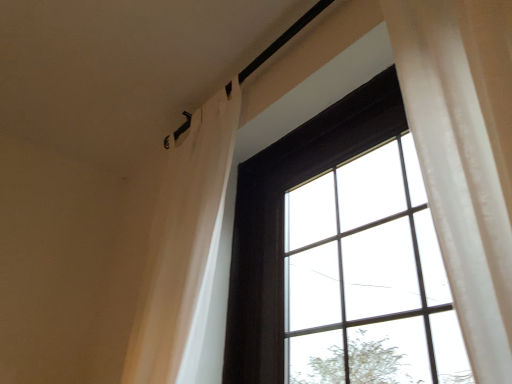
Describe the element at coordinates (340, 256) in the screenshot. I see `matte black window at center` at that location.

Find the location of a particular element. This screenshot has width=512, height=384. matte black window at center is located at coordinates (340, 256).

The width and height of the screenshot is (512, 384). In order to click on white sheer curtain at upper left in this screenshot , I will do `click(184, 245)`.

Image resolution: width=512 pixels, height=384 pixels. Describe the element at coordinates (184, 245) in the screenshot. I see `white sheer curtain at upper left` at that location.

Identify the location of matte black window at center. (340, 256).

From the picture: Considering the relative positions of white sheer curtain at upper left and matte black window at center in the image provided, is white sheer curtain at upper left to the left of matte black window at center from the viewer's perspective?

Yes.

Does white sheer curtain at upper left lie in front of matte black window at center?

No.

Which is nearer, (x=189, y=226) or (x=394, y=159)?

Point (x=189, y=226) is positioned farther from the camera compared to point (x=394, y=159).

From the image's perspective, which is above, white sheer curtain at upper left or matte black window at center?

white sheer curtain at upper left appears higher in the image.

Based on the photo, from a real-world perspective, is white sheer curtain at upper left on matte black window at center?

Indeed, from a real-world perspective, white sheer curtain at upper left stands above matte black window at center.

Is white sheer curtain at upper left thinner than matte black window at center?

In fact, white sheer curtain at upper left might be wider than matte black window at center.

Who is shorter, white sheer curtain at upper left or matte black window at center?

matte black window at center.

Based on their sizes in the image, would you say white sheer curtain at upper left is bigger or smaller than matte black window at center?

white sheer curtain at upper left is smaller than matte black window at center.

Is white sheer curtain at upper left not within matte black window at center?

Indeed, white sheer curtain at upper left is completely outside matte black window at center.

Can you see white sheer curtain at upper left touching matte black window at center?

No, white sheer curtain at upper left is not touching matte black window at center.

Could you tell me if white sheer curtain at upper left is facing matte black window at center?

No, white sheer curtain at upper left is not facing towards matte black window at center.

Identify the location of window that appears on the right of white sheer curtain at upper left. (340, 256).

Is matte black window at center at the left side of white sheer curtain at upper left?

No, matte black window at center is not to the left of white sheer curtain at upper left.

Relative to white sheer curtain at upper left, is matte black window at center in front or behind?

In the image, matte black window at center appears in front of white sheer curtain at upper left.

Considering the points (287, 265) and (175, 174), which point is behind, point (287, 265) or point (175, 174)?

The point (175, 174) is more distant.

From the image's perspective, which one is positioned lower, matte black window at center or white sheer curtain at upper left?

matte black window at center is shown below in the image.

From a real-world perspective, does matte black window at center sit lower than white sheer curtain at upper left?

Correct, in the physical world, matte black window at center is lower than white sheer curtain at upper left.

Does matte black window at center have a lesser width compared to white sheer curtain at upper left?

Yes, matte black window at center is thinner than white sheer curtain at upper left.

Considering the relative sizes of matte black window at center and white sheer curtain at upper left in the image provided, is matte black window at center shorter than white sheer curtain at upper left?

Correct, matte black window at center is not as tall as white sheer curtain at upper left.

In terms of size, does matte black window at center appear bigger or smaller than white sheer curtain at upper left?

In the image, matte black window at center appears to be larger than white sheer curtain at upper left.

Is matte black window at center situated inside white sheer curtain at upper left or outside?

matte black window at center exists outside the volume of white sheer curtain at upper left.

Is matte black window at center touching white sheer curtain at upper left?

There is a gap between matte black window at center and white sheer curtain at upper left.

Does matte black window at center turn towards white sheer curtain at upper left?

Yes, matte black window at center is facing white sheer curtain at upper left.

Can you tell me how much matte black window at center and white sheer curtain at upper left differ in facing direction?

0.00262 degrees separate the facing orientations of matte black window at center and white sheer curtain at upper left.

The height and width of the screenshot is (384, 512). I want to click on window located underneath the white sheer curtain at upper left (from a real-world perspective), so click(x=340, y=256).

Image resolution: width=512 pixels, height=384 pixels. I want to click on shower curtain behind the matte black window at center, so 184,245.

In the image, there is a white sheer curtain at upper left. What are the coordinates of `window below it (from a real-world perspective)` in the screenshot? It's located at (340, 256).